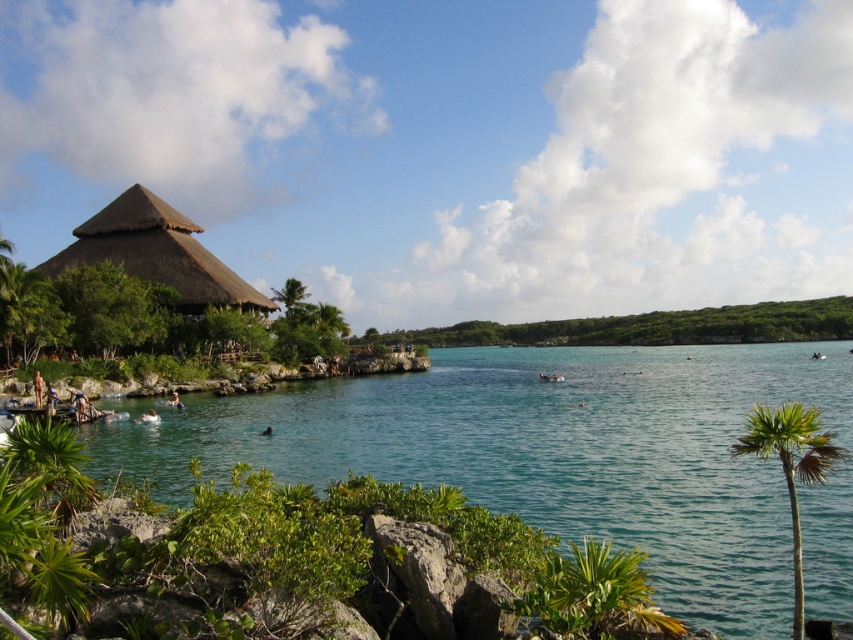
You are planning to set up a picnic area in this tropical setting. You have two options for locations based on the image provided. The first option is near the green leafy vegetation at center, and the second is near the brown thatch hut at left. Considering the size of these two areas, which location would provide more space for your picnic setup?

The green leafy vegetation at center has a larger size compared to the brown thatch hut at left, so the area near the green leafy vegetation at center would provide more space for your picnic setup.

You are standing at the edge of the tropical setting and notice the clear blue water at center and the green leafy vegetation at center. Which object is positioned lower in the scene?

The clear blue water at center is positioned lower than the green leafy vegetation at center.

You are standing at the edge of the beach and want to take a photo of the green leafy palm tree at lower right without the clear blue water at center blocking the view. Is the palm tree visible in your current position?

The clear blue water at center is located above the green leafy palm tree at lower right, so the palm tree is partially or fully obscured by the water. Move to a position where you can see below the water level to capture the palm tree without obstruction.